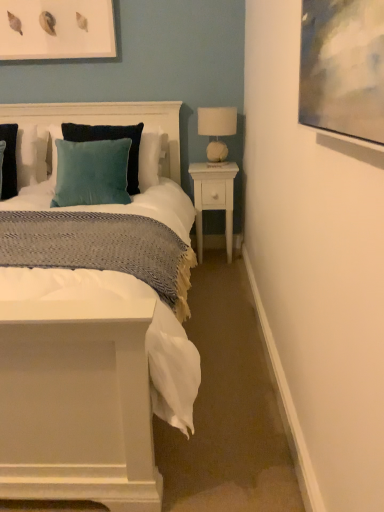
Question: Considering the positions of velvet cushion at upper left and white wood nightstand at right in the image, is velvet cushion at upper left taller or shorter than white wood nightstand at right?

Choices:
 (A) tall
 (B) short

Answer: (B)

Question: Would you say velvet cushion at upper left is to the left or to the right of white wood nightstand at right in the picture?

Choices:
 (A) right
 (B) left

Answer: (B)

Question: Which of these objects is positioned farthest from the white wood nightstand at right?

Choices:
 (A) white textured lampshade at right
 (B) velvet cushion at upper left
 (C) matte white picture frame at upper left
 (D) velvet teal pillow at center

Answer: (C)

Question: Based on their relative distances, which object is farther from the white wood nightstand at right?

Choices:
 (A) white textured lampshade at right
 (B) matte white picture frame at upper left
 (C) velvet teal pillow at center
 (D) velvet cushion at upper left

Answer: (B)